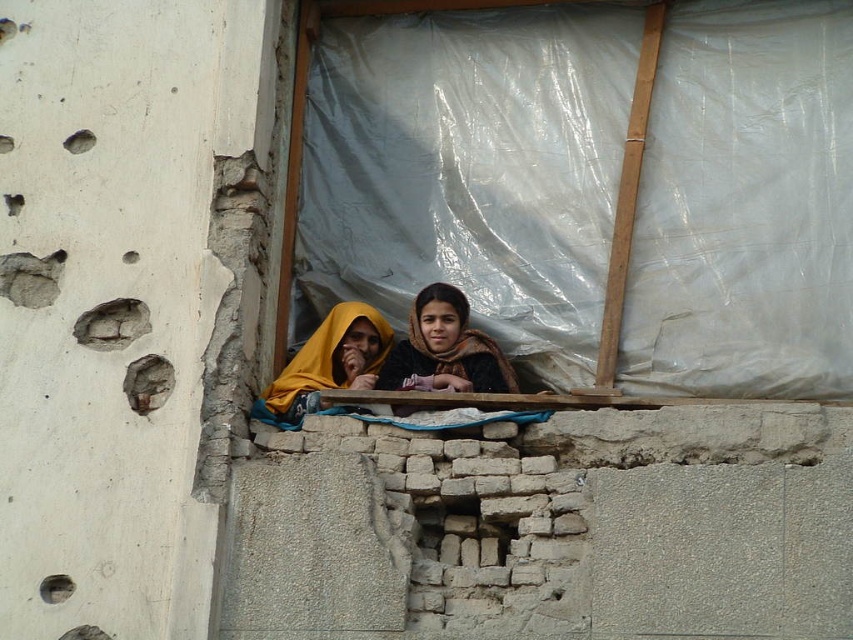
Between dark brown scarf at center and yellow fabric at center, which one is positioned lower?

yellow fabric at center is below.

Is dark brown scarf at center to the left of yellow fabric at center from the viewer's perspective?

No, dark brown scarf at center is not to the left of yellow fabric at center.

I want to click on dark brown scarf at center, so click(x=445, y=348).